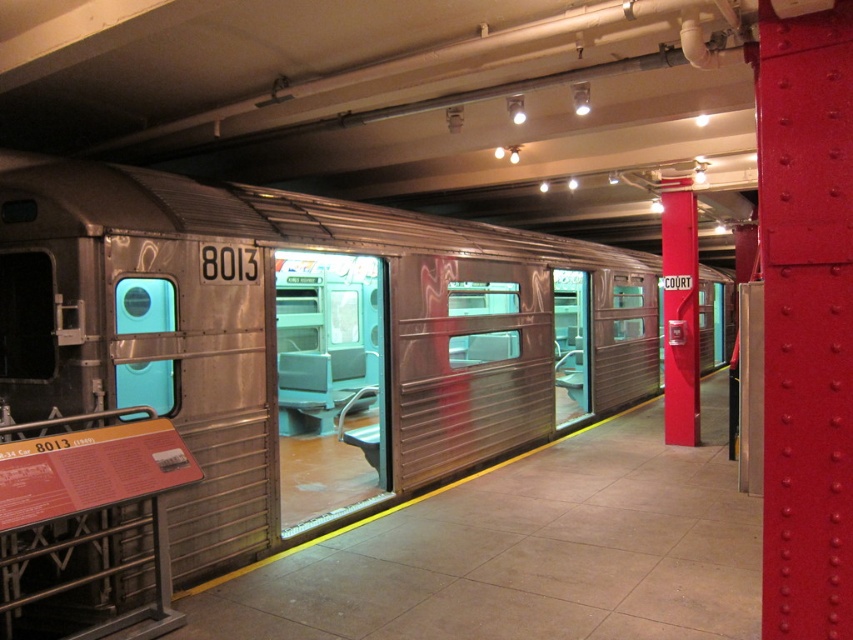
Question: Can you confirm if smooth red pillar at center right is wider than teal plastic door at center?

Choices:
 (A) no
 (B) yes

Answer: (B)

Question: Which point is closer to the camera?

Choices:
 (A) (138, 300)
 (B) (688, 388)

Answer: (A)

Question: Is smooth red pillar at center right positioned behind teal plastic door at center?

Choices:
 (A) yes
 (B) no

Answer: (A)

Question: Which object appears closest to the camera in this image?

Choices:
 (A) teal plastic door at center
 (B) smooth red pillar at center right

Answer: (A)

Question: Can you confirm if smooth red pillar at center right is positioned to the left of teal plastic door at center?

Choices:
 (A) yes
 (B) no

Answer: (B)